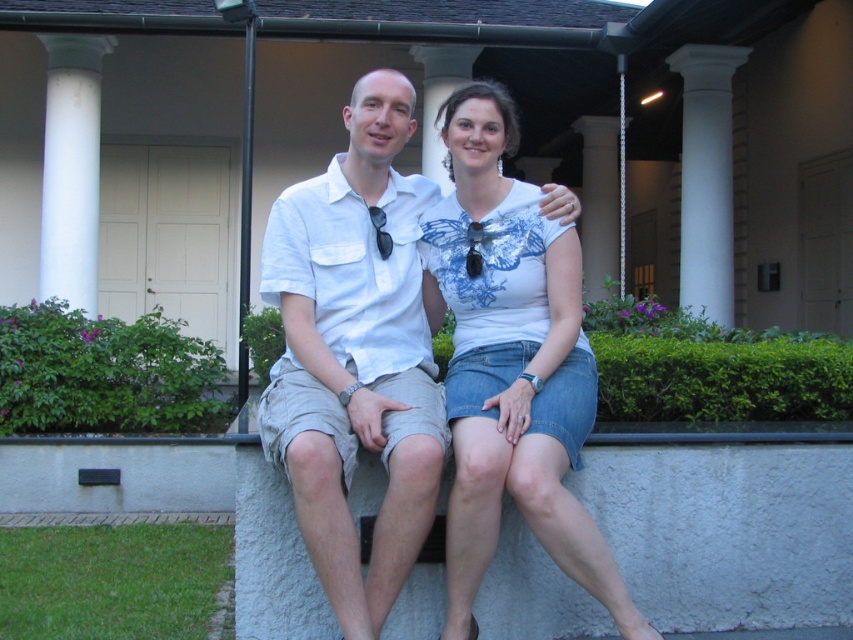
Question: Is white smooth column at left above white stone pillar at center?

Choices:
 (A) yes
 (B) no

Answer: (B)

Question: Does white cotton t-shirt at center lie behind white smooth column at left?

Choices:
 (A) no
 (B) yes

Answer: (A)

Question: In this image, where is white cotton t-shirt at center located relative to white smooth column at right?

Choices:
 (A) left
 (B) right

Answer: (A)

Question: Which object is the farthest from the white cotton t-shirt at center?

Choices:
 (A) white marble pillar at center
 (B) white stone pillar at center
 (C) white smooth column at right

Answer: (A)

Question: Among these objects, which one is nearest to the camera?

Choices:
 (A) white smooth column at right
 (B) white stone pillar at center
 (C) white cotton shirt at center
 (D) white smooth column at left

Answer: (C)

Question: Which object is farther from the camera taking this photo?

Choices:
 (A) white stone pillar at center
 (B) white smooth column at right

Answer: (B)